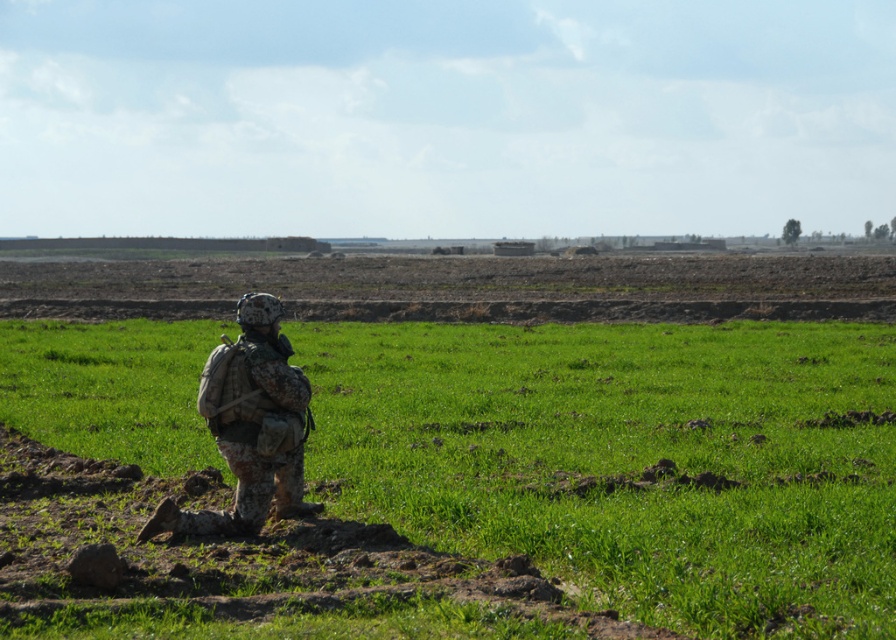
Question: Which object appears closest to the camera in this image?

Choices:
 (A) green grass at center
 (B) camouflage fabric soldier at center

Answer: (A)

Question: Which is farther from the dull brown soil at center?

Choices:
 (A) green grass at center
 (B) camouflage fabric soldier at center

Answer: (B)

Question: Which point is closer to the camera taking this photo?

Choices:
 (A) (703, 307)
 (B) (203, 413)
 (C) (859, 484)

Answer: (B)

Question: Can you confirm if green grass at center is bigger than dull brown soil at center?

Choices:
 (A) no
 (B) yes

Answer: (A)

Question: Considering the relative positions of green grass at center and camouflage fabric soldier at center in the image provided, where is green grass at center located with respect to camouflage fabric soldier at center?

Choices:
 (A) right
 (B) left

Answer: (A)

Question: Is the position of green grass at center less distant than that of camouflage fabric soldier at center?

Choices:
 (A) no
 (B) yes

Answer: (B)